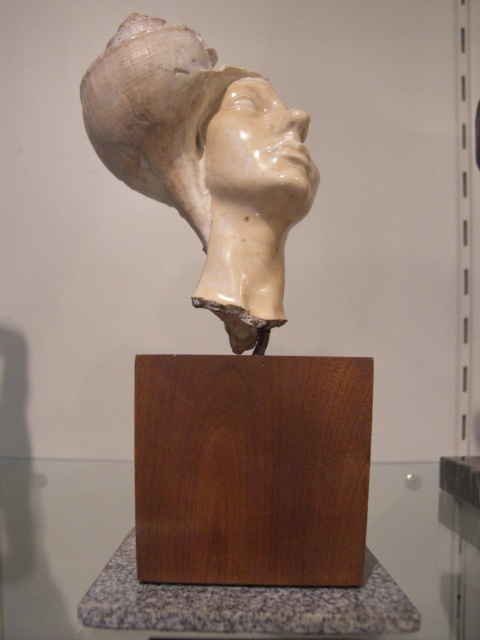
You are an art curator examining two sculptures in the center of the room. You notice that one is a white porcelain sculpture at center and the other is a matte white sculpture at center. Which sculpture is positioned closer to you?

The white porcelain sculpture at center is closer to the viewer than the matte white sculpture at center.

You are an art curator examining the sculpture. You need to determine the placement of the dark brown wood at center and the white glossy sculpture at center. Which object is positioned lower in the image?

The dark brown wood at center is located below the white glossy sculpture at center, so it is positioned lower in the image.